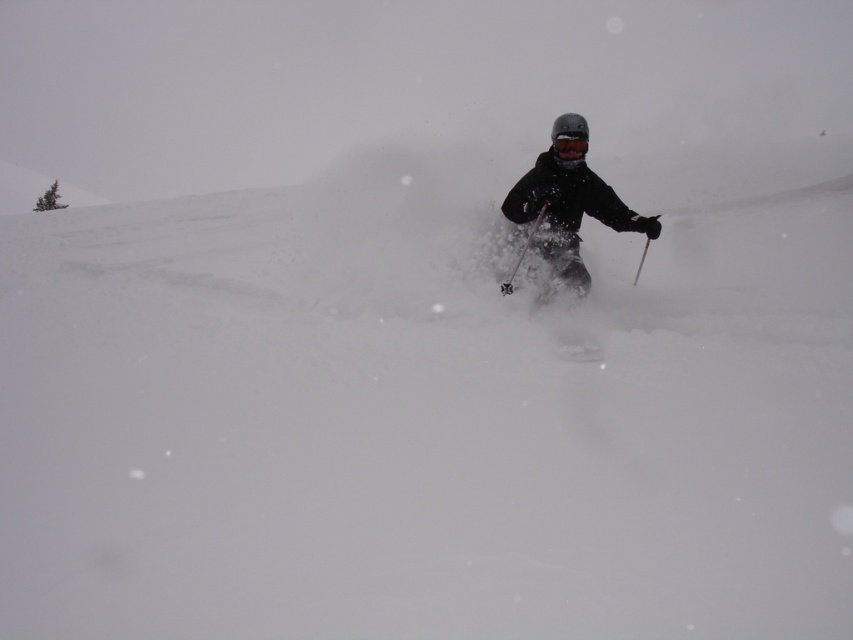
Does matte black ski suit at center appear on the right side of metallic silver ski pole at center?

Correct, you'll find matte black ski suit at center to the right of metallic silver ski pole at center.

Is matte black ski suit at center below metallic silver ski pole at center?

No, matte black ski suit at center is not below metallic silver ski pole at center.

Between point (583, 168) and point (505, 292), which one is positioned behind?

The point (583, 168) is more distant.

The height and width of the screenshot is (640, 853). I want to click on matte black ski suit at center, so [567, 212].

Does point (563, 125) lie in front of point (554, 147)?

Yes, it is.

Is point (555, 177) positioned before point (573, 156)?

No, it is behind (573, 156).

You are a GUI agent. You are given a task and a screenshot of the screen. Output one action in this format:
    pyautogui.click(x=<x>, y=<y>)
    Task: Click on the matte black ski suit at center
    This screenshot has height=640, width=853.
    Given the screenshot: What is the action you would take?
    pyautogui.click(x=567, y=212)

Does transparent plastic goggles at center have a larger size compared to metallic silver ski pole at center?

Actually, transparent plastic goggles at center might be smaller than metallic silver ski pole at center.

Is point (567, 152) in front of point (512, 269)?

That is True.

What do you see at coordinates (569, 144) in the screenshot?
I see `transparent plastic goggles at center` at bounding box center [569, 144].

Where is `transparent plastic goggles at center`? The image size is (853, 640). transparent plastic goggles at center is located at coordinates (569, 144).